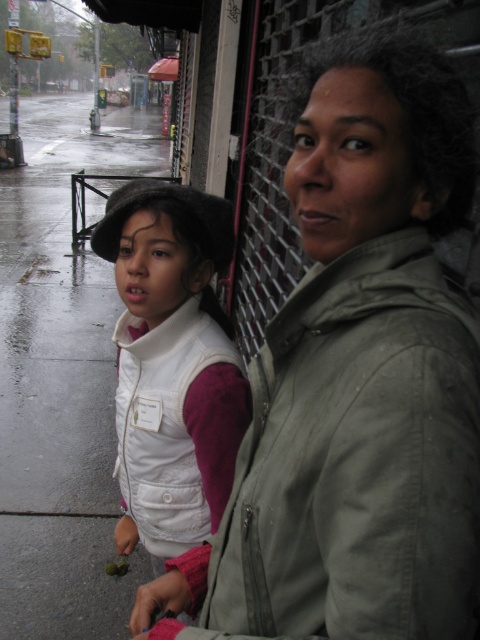
In the scene shown: Is wet asphalt sidewalk at left further to the viewer compared to white matte vest at center?

Yes, it is behind white matte vest at center.

Who is positioned more to the right, wet asphalt sidewalk at left or white matte vest at center?

Positioned to the right is white matte vest at center.

Which is behind, point (91, 442) or point (154, 326)?

The point (91, 442) is more distant.

I want to click on wet asphalt sidewalk at left, so click(x=60, y=380).

Where is `green matte jacket at center`? green matte jacket at center is located at coordinates (356, 461).

Who is positioned more to the left, green matte jacket at center or white matte vest at center?

white matte vest at center

Does point (311, 392) come in front of point (231, 356)?

That is True.

Image resolution: width=480 pixels, height=640 pixels. Find the location of `green matte jacket at center`. green matte jacket at center is located at coordinates (356, 461).

Based on the photo, is green matte jacket at center taller than wet asphalt sidewalk at left?

No.

Who is higher up, green matte jacket at center or wet asphalt sidewalk at left?

wet asphalt sidewalk at left is higher up.

Does point (297, 552) lie in front of point (85, 392)?

That is True.

At what (x,y) coordinates should I click in order to perform the action: click on green matte jacket at center. Please return your answer as a coordinate pair (x, y). This screenshot has width=480, height=640. Looking at the image, I should click on (356, 461).